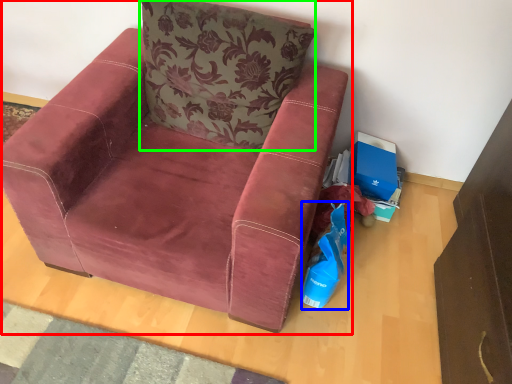
Question: Based on their relative distances, which object is nearer to chair (highlighted by a red box)? Choose from shopping bag (highlighted by a blue box) and pillow (highlighted by a green box).

Choices:
 (A) shopping bag
 (B) pillow

Answer: (B)